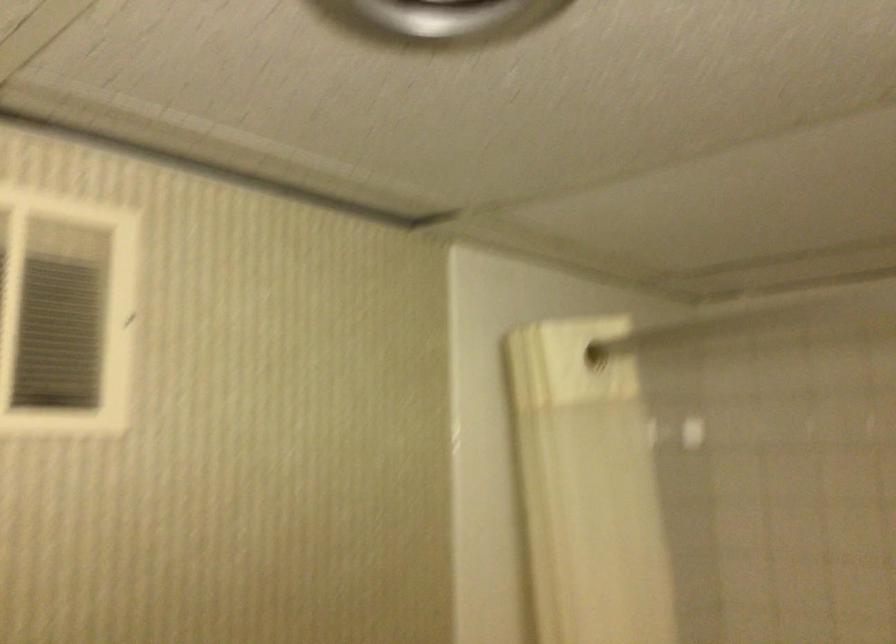
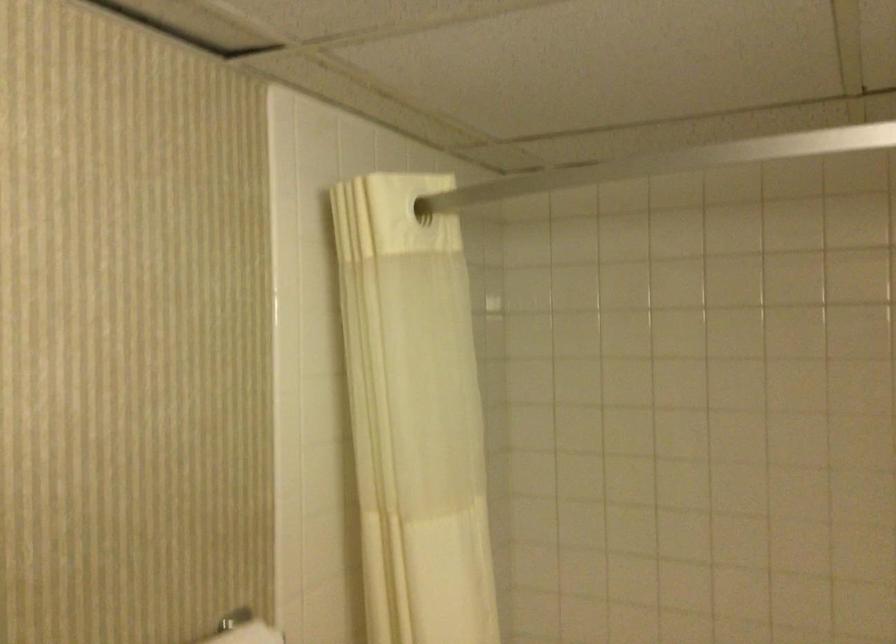
What movement of the cameraman would produce the second image?

The movement direction of the cameraman is left, forward.